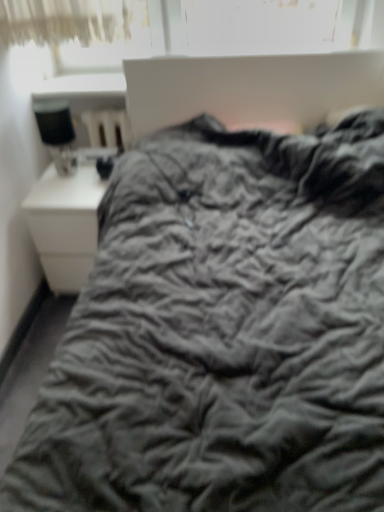
Question: Is matte black lamp at left positioned far away from white glossy nightstand at left?

Choices:
 (A) no
 (B) yes

Answer: (A)

Question: Is matte black lamp at left beside white glossy nightstand at left?

Choices:
 (A) no
 (B) yes

Answer: (A)

Question: Can you confirm if matte black lamp at left is positioned to the left of white glossy nightstand at left?

Choices:
 (A) no
 (B) yes

Answer: (B)

Question: Can we say matte black lamp at left lies outside white glossy nightstand at left?

Choices:
 (A) yes
 (B) no

Answer: (A)

Question: From the image's perspective, does matte black lamp at left appear higher than white glossy nightstand at left?

Choices:
 (A) yes
 (B) no

Answer: (A)

Question: From a real-world perspective, does matte black lamp at left stand above white glossy nightstand at left?

Choices:
 (A) no
 (B) yes

Answer: (B)

Question: Considering the relative sizes of white glossy nightstand at left and matte black lamp at left in the image provided, is white glossy nightstand at left thinner than matte black lamp at left?

Choices:
 (A) no
 (B) yes

Answer: (A)

Question: From the image's perspective, is white glossy nightstand at left on matte black lamp at left?

Choices:
 (A) yes
 (B) no

Answer: (B)

Question: Is white glossy nightstand at left at the left side of matte black lamp at left?

Choices:
 (A) yes
 (B) no

Answer: (B)

Question: Is matte black lamp at left at the back of white glossy nightstand at left?

Choices:
 (A) yes
 (B) no

Answer: (B)

Question: Is white glossy nightstand at left bigger than matte black lamp at left?

Choices:
 (A) no
 (B) yes

Answer: (B)

Question: Is white glossy nightstand at left placed right next to matte black lamp at left?

Choices:
 (A) no
 (B) yes

Answer: (A)

Question: Would you say white glossy nightstand at left is to the left or to the right of matte black lamp at left in the picture?

Choices:
 (A) left
 (B) right

Answer: (B)